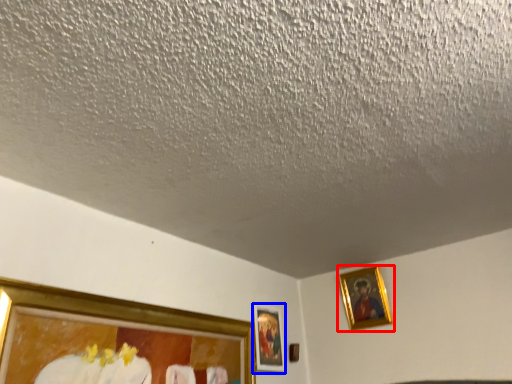
Question: Which of the following is the closest to the observer, picture frame (highlighted by a red box) or picture frame (highlighted by a blue box)?

Choices:
 (A) picture frame
 (B) picture frame

Answer: (B)